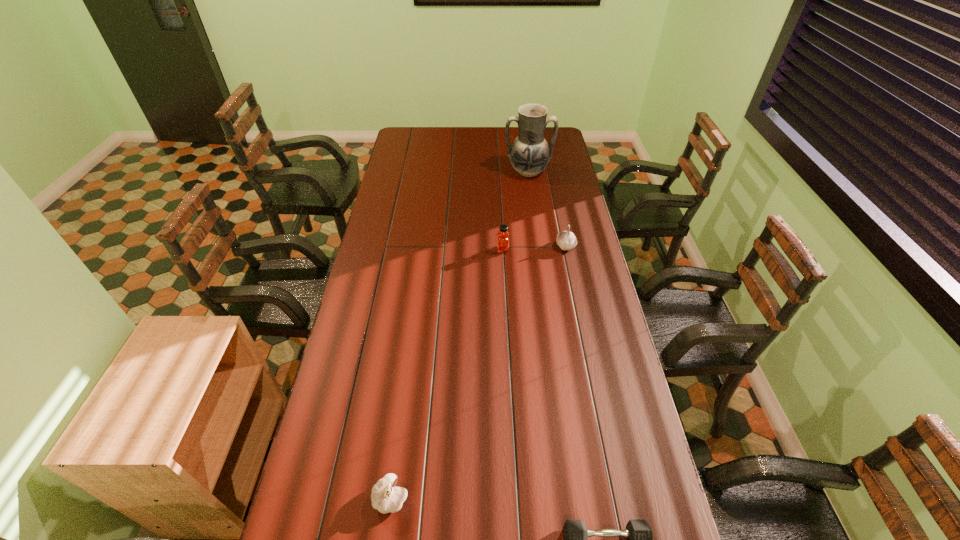
This screenshot has width=960, height=540. I want to click on vacant space positioned on the left of the farther garlic, so click(x=531, y=246).

In order to click on vacant space located 0.080m on the left of the fourth farthest object in this screenshot , I will do `click(342, 498)`.

At what (x,y) coordinates should I click in order to perform the action: click on pitcher that is at the right edge. Please return your answer as a coordinate pair (x, y). This screenshot has height=540, width=960. Looking at the image, I should click on (529, 154).

You are a GUI agent. You are given a task and a screenshot of the screen. Output one action in this format:
    pyautogui.click(x=<x>, y=<y>)
    Task: Click on the garlic that is at the right edge
    Image resolution: width=960 pixels, height=540 pixels.
    Given the screenshot: What is the action you would take?
    (x=566, y=240)

Identify the location of free location at the far edge of the desktop. (457, 129).

Where is `free space at the left edge of the desktop`? The width and height of the screenshot is (960, 540). free space at the left edge of the desktop is located at coordinates (351, 491).

In order to click on vacant space at the right edge of the desktop in this screenshot , I will do `click(601, 340)`.

Where is `free space at the far left corner of the desktop`? This screenshot has width=960, height=540. free space at the far left corner of the desktop is located at coordinates (428, 129).

At what (x,y) coordinates should I click in order to perform the action: click on free point between the honey and the pitcher. Please return your answer as a coordinate pair (x, y). Looking at the image, I should click on (516, 211).

You are a GUI agent. You are given a task and a screenshot of the screen. Output one action in this format:
    pyautogui.click(x=<x>, y=<y>)
    Task: Click on the free space between the honey and the farthest object
    The image size is (960, 540).
    Given the screenshot: What is the action you would take?
    pyautogui.click(x=516, y=211)